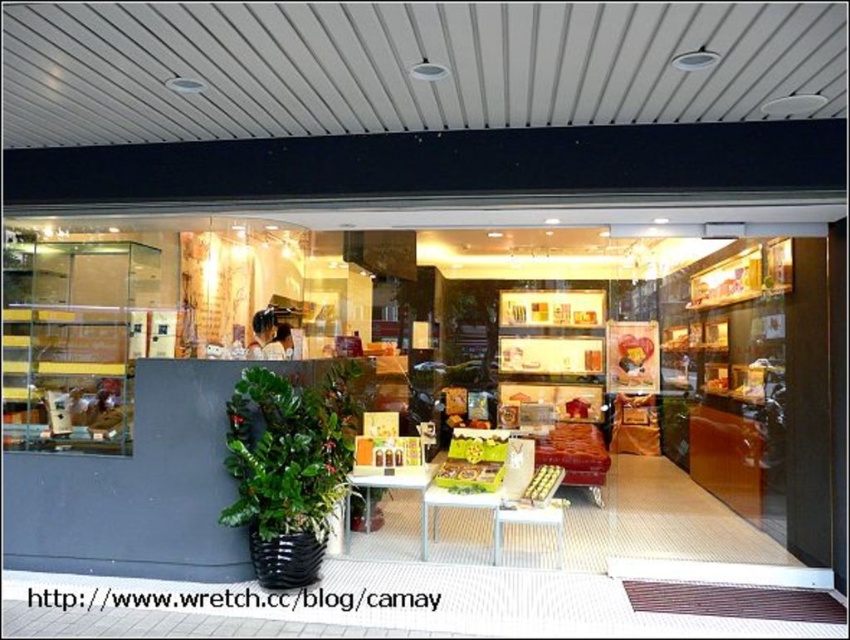
Is matte brown furniture at center to the left of green matte plant at lower left from the viewer's perspective?

No, matte brown furniture at center is not to the left of green matte plant at lower left.

Is matte brown furniture at center wider than green matte plant at lower left?

Incorrect, matte brown furniture at center's width does not surpass green matte plant at lower left's.

Where is `matte brown furniture at center`? This screenshot has height=640, width=850. matte brown furniture at center is located at coordinates (659, 346).

Can you confirm if green matte plant at lower left is thinner than wooden table at center?

Indeed, green matte plant at lower left has a lesser width compared to wooden table at center.

Does green matte plant at lower left have a larger size compared to wooden table at center?

Yes, green matte plant at lower left is bigger than wooden table at center.

Does point (250, 531) come behind point (426, 540)?

No, (250, 531) is closer to viewer.

The height and width of the screenshot is (640, 850). I want to click on green matte plant at lower left, so click(x=289, y=449).

The image size is (850, 640). What do you see at coordinates (659, 346) in the screenshot? I see `matte brown furniture at center` at bounding box center [659, 346].

Between matte brown furniture at center and wooden table at center, which one is positioned higher?

Positioned higher is matte brown furniture at center.

Image resolution: width=850 pixels, height=640 pixels. Identify the location of matte brown furniture at center. [659, 346].

At what (x,y) coordinates should I click in order to perform the action: click on matte brown furniture at center. Please return your answer as a coordinate pair (x, y). The image size is (850, 640). Looking at the image, I should click on (659, 346).